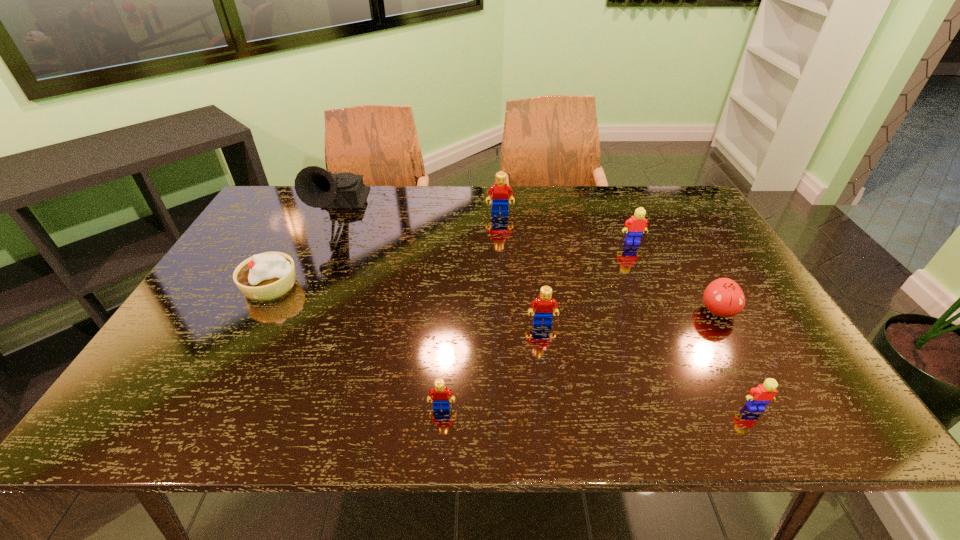
This screenshot has width=960, height=540. Identify the location of the smaller yellow Lego. (758, 397).

What are the coordinates of `the right yellow Lego` in the screenshot? It's located at (758, 397).

Image resolution: width=960 pixels, height=540 pixels. What are the coordinates of `the leftmost red Lego` in the screenshot? It's located at (440, 393).

This screenshot has height=540, width=960. In order to click on the third object from left to right in this screenshot , I will do `click(440, 393)`.

You are a GUI agent. You are given a task and a screenshot of the screen. Output one action in this format:
    pyautogui.click(x=<x>, y=<y>)
    Task: Click on the free space located from the horn of the black phonograph_record
    This screenshot has width=960, height=540.
    Given the screenshot: What is the action you would take?
    pyautogui.click(x=281, y=335)

Locate an element on the screen. free location located on the front-facing side of the tallest Lego is located at coordinates (505, 291).

At what (x,y) coordinates should I click in order to perform the action: click on free space located 0.130m on the front-facing side of the sixth nearest object. Please return your answer as a coordinate pair (x, y). This screenshot has height=540, width=960. Looking at the image, I should click on (646, 273).

At what (x,y) coordinates should I click in order to perform the action: click on free space located on the front-facing side of the second farthest red Lego. Please return your answer as a coordinate pair (x, y). The width and height of the screenshot is (960, 540). Looking at the image, I should click on (558, 429).

What are the coordinates of `vacant space located 0.100m on the back of the beige whipped cream` in the screenshot? It's located at (292, 247).

Locate an element on the screen. Image resolution: width=960 pixels, height=540 pixels. vacant point located 0.190m on the front of the apple is located at coordinates (764, 392).